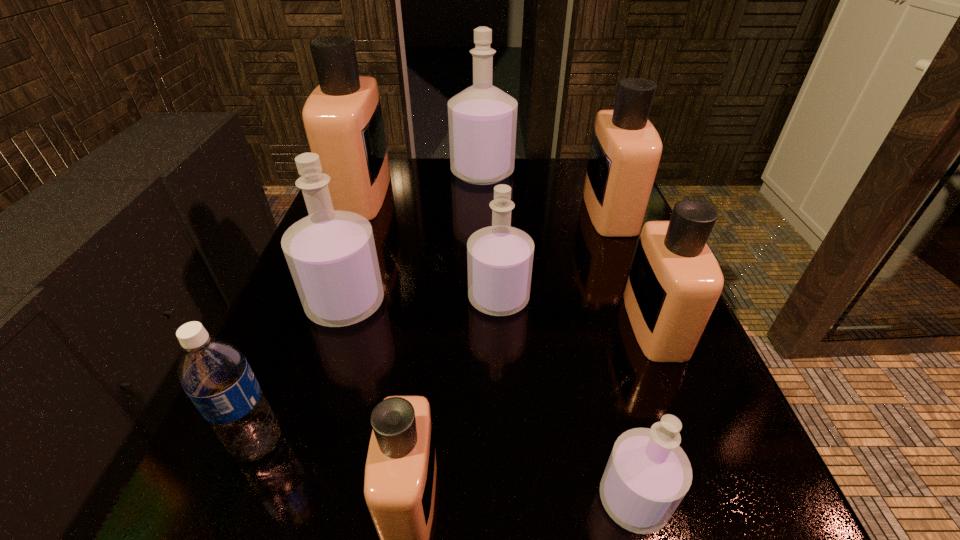
What are the coordinates of `free space located 0.300m on the back of the nearest purple perfume` in the screenshot? It's located at (585, 308).

Find the location of a particular element. object that is at the near edge is located at coordinates (648, 474).

I want to click on water bottle that is at the left edge, so click(213, 372).

Where is `object located in the far left corner section of the desktop`? The image size is (960, 540). object located in the far left corner section of the desktop is located at coordinates (342, 117).

Identify the location of object situated at the far right corner. This screenshot has height=540, width=960. (625, 152).

Locate an element on the screen. This screenshot has width=960, height=540. object at the near right corner is located at coordinates (648, 474).

The height and width of the screenshot is (540, 960). Identify the location of free space at the far edge of the desktop. (538, 160).

The width and height of the screenshot is (960, 540). What are the coordinates of `free space at the left edge of the desktop` in the screenshot? It's located at (269, 478).

This screenshot has width=960, height=540. Find the location of `free space at the right edge of the desktop`. free space at the right edge of the desktop is located at coordinates (619, 252).

I want to click on free space at the far left corner of the desktop, so click(389, 194).